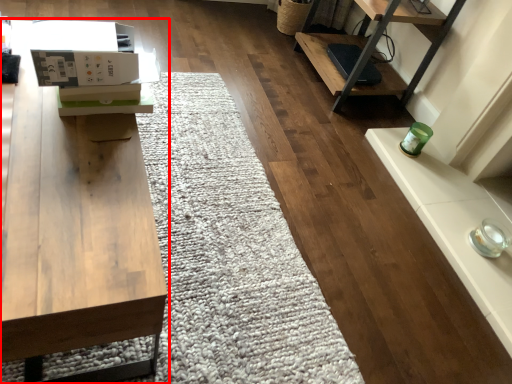
Question: From the image's perspective, what is the correct spatial relationship of table (annotated by the red box) in relation to cardboard box?

Choices:
 (A) above
 (B) below

Answer: (B)